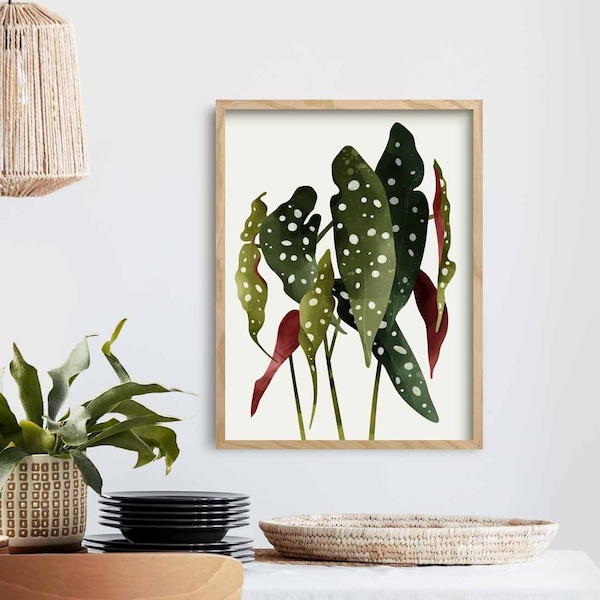
The image size is (600, 600). I want to click on art work, so click(438, 422).